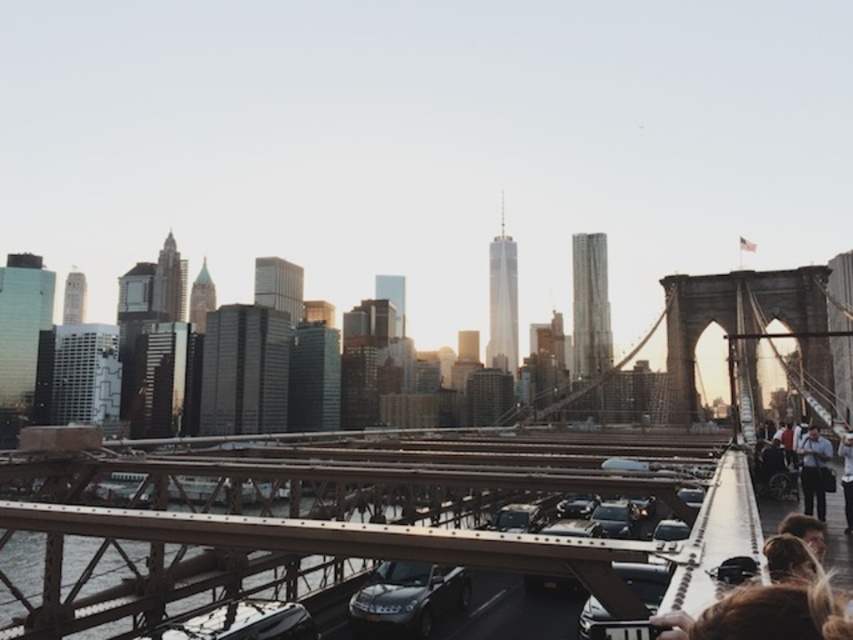
You are standing at the point marked as point (x=645, y=580) on the Brooklyn Bridge. What object is located exactly at that point?

The metallic silver car at center is located exactly at point (x=645, y=580).

You are a photographer standing on the Brooklyn Bridge during the late afternoon. You notice two cars in the center of the bridge, a shiny black car at center and a shiny silver car at center. Which car do you think would appear bigger in your photo?

The shiny black car at center appears bigger in the photo because it is larger in size than the shiny silver car at center.